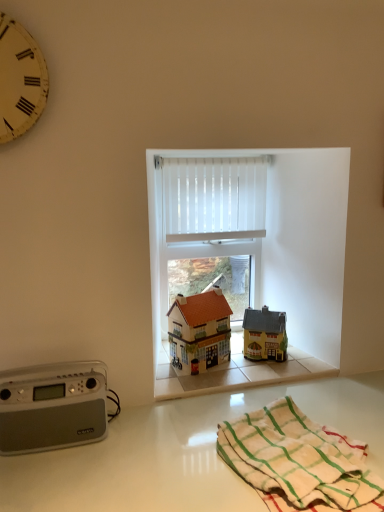
The width and height of the screenshot is (384, 512). Find the location of `vacant space in front of yellow matte house at center, the second toy in the left-to-right sequence`. vacant space in front of yellow matte house at center, the second toy in the left-to-right sequence is located at coordinates (263, 372).